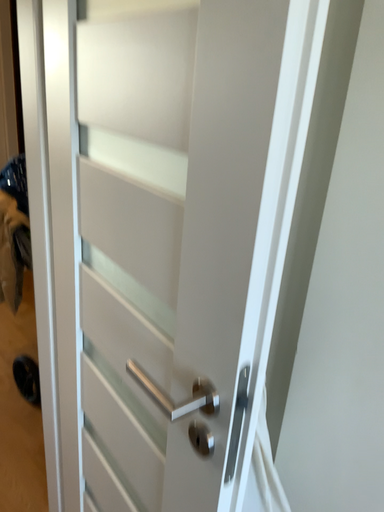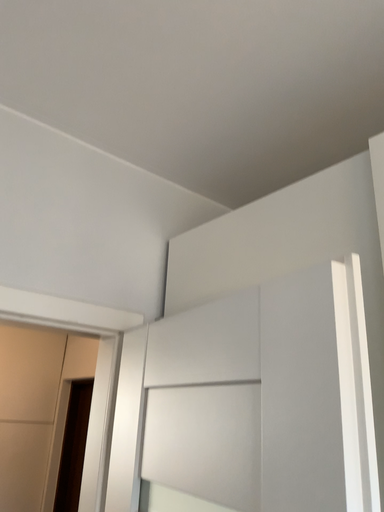
Question: How did the camera likely rotate when shooting the video?

Choices:
 (A) rotated upward
 (B) rotated downward

Answer: (A)